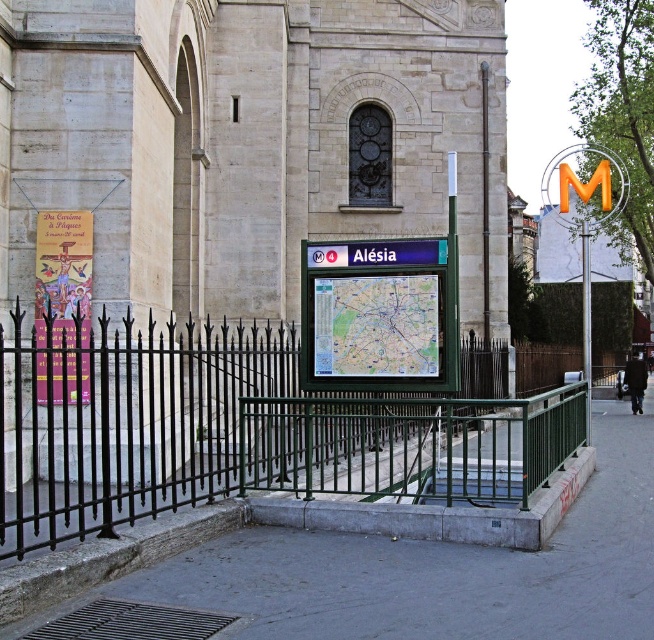
Question: Estimate the real-world distances between objects in this image. Which object is closer to the gray concrete pavement at center?

Choices:
 (A) beige stone church at center
 (B) paper map at center

Answer: (B)

Question: Which object is farther from the camera taking this photo?

Choices:
 (A) gray concrete pavement at center
 (B) beige stone church at center

Answer: (B)

Question: Is the position of beige stone church at center more distant than that of paper map at center?

Choices:
 (A) no
 (B) yes

Answer: (B)

Question: Is the position of beige stone church at center less distant than that of paper map at center?

Choices:
 (A) no
 (B) yes

Answer: (A)

Question: Which of the following is the closest to the observer?

Choices:
 (A) (490, 138)
 (B) (388, 321)

Answer: (B)

Question: Does beige stone church at center have a smaller size compared to gray concrete pavement at center?

Choices:
 (A) yes
 (B) no

Answer: (B)